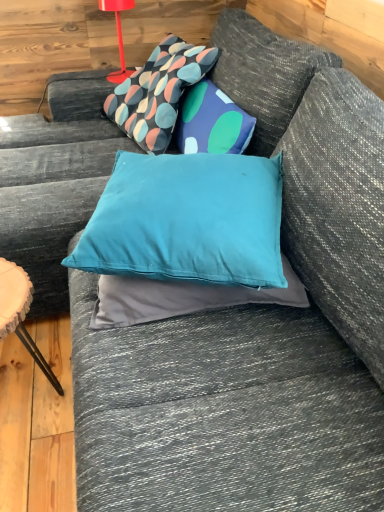
The width and height of the screenshot is (384, 512). What do you see at coordinates (20, 313) in the screenshot? I see `wooden side table at lower left` at bounding box center [20, 313].

How much space does patterned fabric pillow at upper center, the 2th pillow ordered from the bottom, occupy vertically?

The height of patterned fabric pillow at upper center, the 2th pillow ordered from the bottom, is 13.86 inches.

Based on the photo, measure the distance between patterned fabric pillow at upper center, the first pillow positioned from the back, and camera.

patterned fabric pillow at upper center, the first pillow positioned from the back, and camera are 1.53 meters apart from each other.

In order to face matte red table lamp at upper left, should I rotate leftwards or rightwards?

To align with it, rotate left about 9.620°.

At what (x,y) coordinates should I click in order to perform the action: click on wooden side table at lower left. Please return your answer as a coordinate pair (x, y). The image size is (384, 512). Looking at the image, I should click on (20, 313).

From the image's perspective, would you say matte red table lamp at upper left is shown under patterned fabric pillow at upper center, the first pillow positioned from the back?

No, from the image's perspective, matte red table lamp at upper left is not beneath patterned fabric pillow at upper center, the first pillow positioned from the back.

Which is more to the left, matte red table lamp at upper left or patterned fabric pillow at upper center, which ranks as the second pillow in front-to-back order?

Positioned to the left is matte red table lamp at upper left.

Can we say matte red table lamp at upper left lies outside patterned fabric pillow at upper center, which ranks as the second pillow in front-to-back order?

matte red table lamp at upper left is positioned outside patterned fabric pillow at upper center, which ranks as the second pillow in front-to-back order.

Considering the relative sizes of matte red table lamp at upper left and patterned fabric pillow at upper center, the 2th pillow ordered from the bottom, in the image provided, is matte red table lamp at upper left shorter than patterned fabric pillow at upper center, the 2th pillow ordered from the bottom,?

Yes, matte red table lamp at upper left is shorter than patterned fabric pillow at upper center, the 2th pillow ordered from the bottom.

Is matte red table lamp at upper left oriented towards teal fabric pillow at center, which is the 2th pillow from top to bottom?

Yes, matte red table lamp at upper left faces towards teal fabric pillow at center, which is the 2th pillow from top to bottom.

Considering the points (121, 61) and (156, 275), which point is behind, point (121, 61) or point (156, 275)?

Positioned behind is point (121, 61).

From the image's perspective, is matte red table lamp at upper left beneath teal fabric pillow at center, which is the 2th pillow from top to bottom?

No.

Which object is wider, matte red table lamp at upper left or teal fabric pillow at center, which is the 2th pillow from top to bottom?

teal fabric pillow at center, which is the 2th pillow from top to bottom.

In terms of width, does teal fabric pillow at center, positioned as the first pillow in front-to-back order, look wider or thinner when compared to matte red table lamp at upper left?

Clearly, teal fabric pillow at center, positioned as the first pillow in front-to-back order, has more width compared to matte red table lamp at upper left.

Would you say teal fabric pillow at center, positioned as the first pillow in front-to-back order, is outside matte red table lamp at upper left?

Yes, teal fabric pillow at center, positioned as the first pillow in front-to-back order, is located beyond the bounds of matte red table lamp at upper left.

How many degrees apart are the facing directions of teal fabric pillow at center, positioned as the first pillow in front-to-back order, and matte red table lamp at upper left?

teal fabric pillow at center, positioned as the first pillow in front-to-back order, and matte red table lamp at upper left are facing 23.5 degrees away from each other.

Considering the sizes of teal fabric pillow at center, positioned as the first pillow in front-to-back order, and matte red table lamp at upper left in the image, is teal fabric pillow at center, positioned as the first pillow in front-to-back order, bigger or smaller than matte red table lamp at upper left?

teal fabric pillow at center, positioned as the first pillow in front-to-back order, is bigger than matte red table lamp at upper left.

Looking at this image, can you tell me how much teal fabric pillow at center, positioned as the first pillow in front-to-back order, and patterned fabric pillow at upper center, which appears as the first pillow when viewed from the top, differ in facing direction?

The facing directions of teal fabric pillow at center, positioned as the first pillow in front-to-back order, and patterned fabric pillow at upper center, which appears as the first pillow when viewed from the top, are 59 degrees apart.

From the image's perspective, which is below, teal fabric pillow at center, which is the second pillow in back-to-front order, or patterned fabric pillow at upper center, the 2th pillow ordered from the bottom?

teal fabric pillow at center, which is the second pillow in back-to-front order, from the image's perspective.

Between teal fabric pillow at center, which is the second pillow in back-to-front order, and patterned fabric pillow at upper center, which ranks as the second pillow in front-to-back order, which one appears on the left side from the viewer's perspective?

Positioned to the left is patterned fabric pillow at upper center, which ranks as the second pillow in front-to-back order.

Based on their sizes in the image, would you say teal fabric pillow at center, which is the 1th pillow in bottom-to-top order, is bigger or smaller than patterned fabric pillow at upper center, which ranks as the second pillow in front-to-back order?

In the image, teal fabric pillow at center, which is the 1th pillow in bottom-to-top order, appears to be smaller than patterned fabric pillow at upper center, which ranks as the second pillow in front-to-back order.

From a real-world perspective, between wooden side table at lower left and patterned fabric pillow at upper center, the 2th pillow ordered from the bottom, who is vertically higher?

patterned fabric pillow at upper center, the 2th pillow ordered from the bottom, is physically above.

Considering the sizes of objects wooden side table at lower left and patterned fabric pillow at upper center, the first pillow positioned from the back, in the image provided, who is shorter, wooden side table at lower left or patterned fabric pillow at upper center, the first pillow positioned from the back,?

patterned fabric pillow at upper center, the first pillow positioned from the back.

From the image's perspective, which one is positioned lower, wooden side table at lower left or patterned fabric pillow at upper center, which ranks as the second pillow in front-to-back order?

From the image's view, wooden side table at lower left is below.

Where is `the 2nd pillow directly beneath the matte red table lamp at upper left (from a real-world perspective)`? The height and width of the screenshot is (512, 384). the 2nd pillow directly beneath the matte red table lamp at upper left (from a real-world perspective) is located at coordinates (158, 92).

From the picture: Can you confirm if patterned fabric pillow at upper center, the 2th pillow ordered from the bottom, is positioned to the right of matte red table lamp at upper left?

Indeed, patterned fabric pillow at upper center, the 2th pillow ordered from the bottom, is positioned on the right side of matte red table lamp at upper left.

How much distance is there between patterned fabric pillow at upper center, which ranks as the second pillow in front-to-back order, and matte red table lamp at upper left?

patterned fabric pillow at upper center, which ranks as the second pillow in front-to-back order, and matte red table lamp at upper left are 9.73 inches apart.

From the image's perspective, would you say patterned fabric pillow at upper center, the first pillow positioned from the back, is shown under matte red table lamp at upper left?

Indeed, from the image's perspective, patterned fabric pillow at upper center, the first pillow positioned from the back, is shown beneath matte red table lamp at upper left.

From the image's perspective, is patterned fabric pillow at upper center, which ranks as the second pillow in front-to-back order, above or below wooden side table at lower left?

Based on their image positions, patterned fabric pillow at upper center, which ranks as the second pillow in front-to-back order, is located above wooden side table at lower left.

Is patterned fabric pillow at upper center, the first pillow positioned from the back, facing towards wooden side table at lower left?

No, patterned fabric pillow at upper center, the first pillow positioned from the back, is not turned towards wooden side table at lower left.

Based on the photo, is patterned fabric pillow at upper center, the 2th pillow ordered from the bottom, at the left side of wooden side table at lower left?

Incorrect, patterned fabric pillow at upper center, the 2th pillow ordered from the bottom, is not on the left side of wooden side table at lower left.

Based on their sizes in the image, would you say patterned fabric pillow at upper center, which ranks as the second pillow in front-to-back order, is bigger or smaller than wooden side table at lower left?

Clearly, patterned fabric pillow at upper center, which ranks as the second pillow in front-to-back order, is larger in size than wooden side table at lower left.

You are a GUI agent. You are given a task and a screenshot of the screen. Output one action in this format:
    pyautogui.click(x=<x>, y=<y>)
    Task: Click on the table lamp lying behind the patterned fabric pillow at upper center, which appears as the first pillow when viewed from the top
    This screenshot has height=512, width=384.
    Given the screenshot: What is the action you would take?
    pyautogui.click(x=118, y=36)

This screenshot has width=384, height=512. Find the location of `pillow that is the 1st object directly below the matte red table lamp at upper left (from a real-world perspective)`. pillow that is the 1st object directly below the matte red table lamp at upper left (from a real-world perspective) is located at coordinates (188, 220).

Estimate the real-world distances between objects in this image. Which object is further from patterned fabric pillow at upper center, which ranks as the second pillow in front-to-back order, matte red table lamp at upper left or teal fabric pillow at center, positioned as the first pillow in front-to-back order?

Among the two, teal fabric pillow at center, positioned as the first pillow in front-to-back order, is located further to patterned fabric pillow at upper center, which ranks as the second pillow in front-to-back order.

Which object lies nearer to the anchor point matte red table lamp at upper left, wooden side table at lower left or teal fabric pillow at center, which is the 2th pillow from top to bottom?

teal fabric pillow at center, which is the 2th pillow from top to bottom.

When comparing their distances from patterned fabric pillow at upper center, which ranks as the second pillow in front-to-back order, does matte red table lamp at upper left or wooden side table at lower left seem closer?

The object closer to patterned fabric pillow at upper center, which ranks as the second pillow in front-to-back order, is matte red table lamp at upper left.

From the image, which object appears to be nearer to matte red table lamp at upper left, wooden side table at lower left or patterned fabric pillow at upper center, which appears as the first pillow when viewed from the top?

patterned fabric pillow at upper center, which appears as the first pillow when viewed from the top, is positioned closer to the anchor matte red table lamp at upper left.

From the image, which object appears to be farther from matte red table lamp at upper left, teal fabric pillow at center, positioned as the first pillow in front-to-back order, or patterned fabric pillow at upper center, which ranks as the second pillow in front-to-back order?

teal fabric pillow at center, positioned as the first pillow in front-to-back order.

Estimate the real-world distances between objects in this image. Which object is further from wooden side table at lower left, patterned fabric pillow at upper center, which ranks as the second pillow in front-to-back order, or matte red table lamp at upper left?

matte red table lamp at upper left lies further to wooden side table at lower left than the other object.

Looking at the image, which one is located further to patterned fabric pillow at upper center, the first pillow positioned from the back, teal fabric pillow at center, which is the second pillow in back-to-front order, or wooden side table at lower left?

Among the two, wooden side table at lower left is located further to patterned fabric pillow at upper center, the first pillow positioned from the back.

Which object lies nearer to the anchor point matte red table lamp at upper left, patterned fabric pillow at upper center, the 2th pillow ordered from the bottom, or teal fabric pillow at center, positioned as the first pillow in front-to-back order?

patterned fabric pillow at upper center, the 2th pillow ordered from the bottom, is closer to matte red table lamp at upper left.

Identify the location of pillow between teal fabric pillow at center, which is the 2th pillow from top to bottom, and matte red table lamp at upper left in the front-back direction. (158, 92).

The height and width of the screenshot is (512, 384). Find the location of `pillow between patterned fabric pillow at upper center, the 2th pillow ordered from the bottom, and wooden side table at lower left, in the vertical direction`. pillow between patterned fabric pillow at upper center, the 2th pillow ordered from the bottom, and wooden side table at lower left, in the vertical direction is located at coordinates (188, 220).